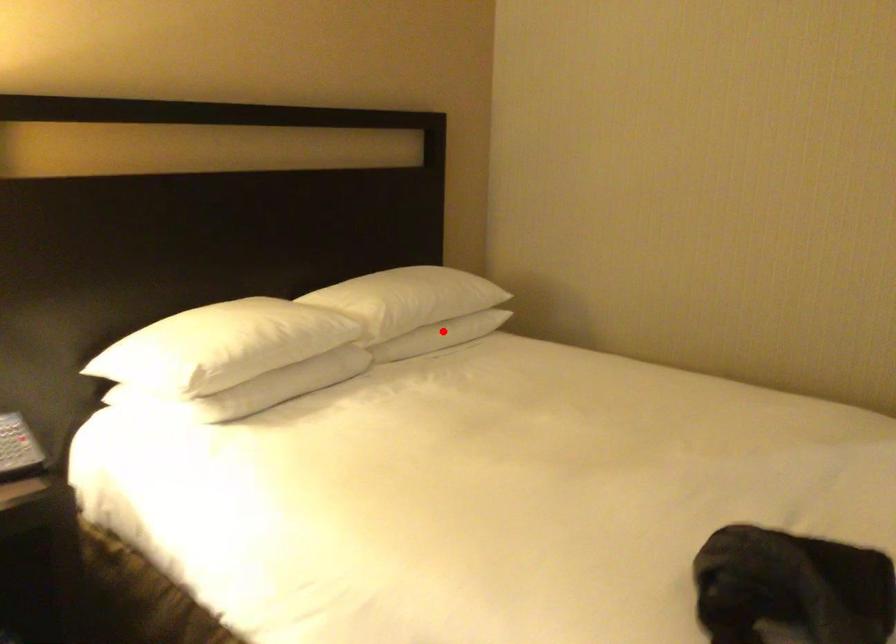
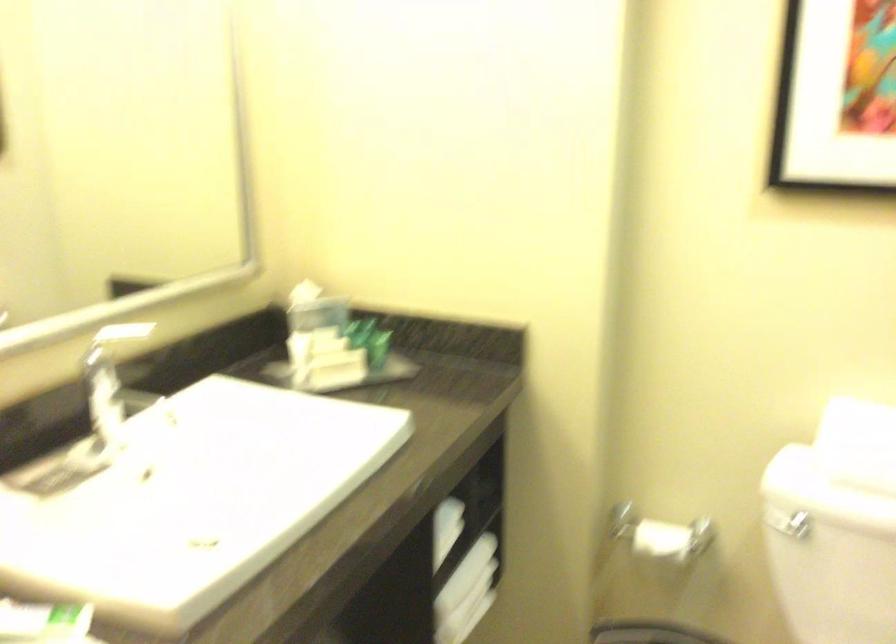
Question: I am providing you with two images of the same scene from different viewpoints. A red point is marked on the first image. Can you still see the location of the red point in image 2?

Choices:
 (A) Yes
 (B) No

Answer: (B)